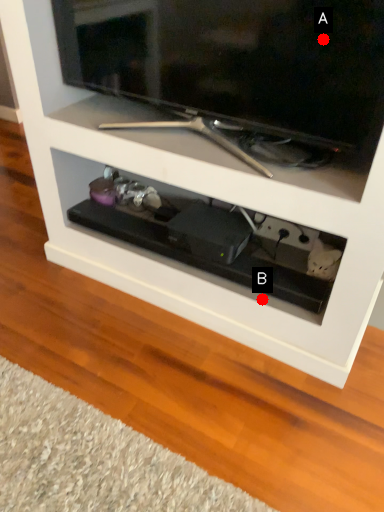
Question: Two points are circled on the image, labeled by A and B beside each circle. Which point appears closest to the camera in this image?

Choices:
 (A) A is closer
 (B) B is closer

Answer: (A)